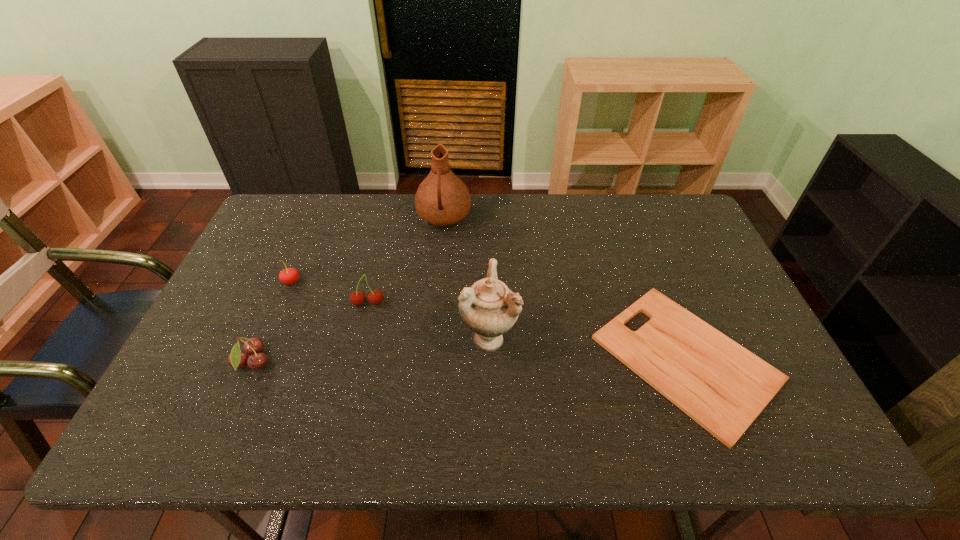
What are the coordinates of `the farthest object` in the screenshot? It's located at (442, 199).

The width and height of the screenshot is (960, 540). What are the coordinates of `urn` in the screenshot? It's located at pyautogui.click(x=489, y=308).

Identify the location of the second farthest cherry. (376, 297).

The width and height of the screenshot is (960, 540). In order to click on the fourth object from right to left in this screenshot , I will do `click(376, 297)`.

Where is `the second farthest object`? Image resolution: width=960 pixels, height=540 pixels. the second farthest object is located at coordinates (288, 276).

Where is `the nearest cherry`? This screenshot has width=960, height=540. the nearest cherry is located at coordinates (254, 346).

Identify the location of the rightmost object. This screenshot has height=540, width=960. (721, 385).

The height and width of the screenshot is (540, 960). Find the location of `chopping board`. chopping board is located at coordinates (721, 385).

Locate an element on the screen. vacant area located on the side of the pitcher with the handle is located at coordinates (440, 267).

Locate an element on the screen. The width and height of the screenshot is (960, 540). vacant space located on the back of the urn is located at coordinates (487, 227).